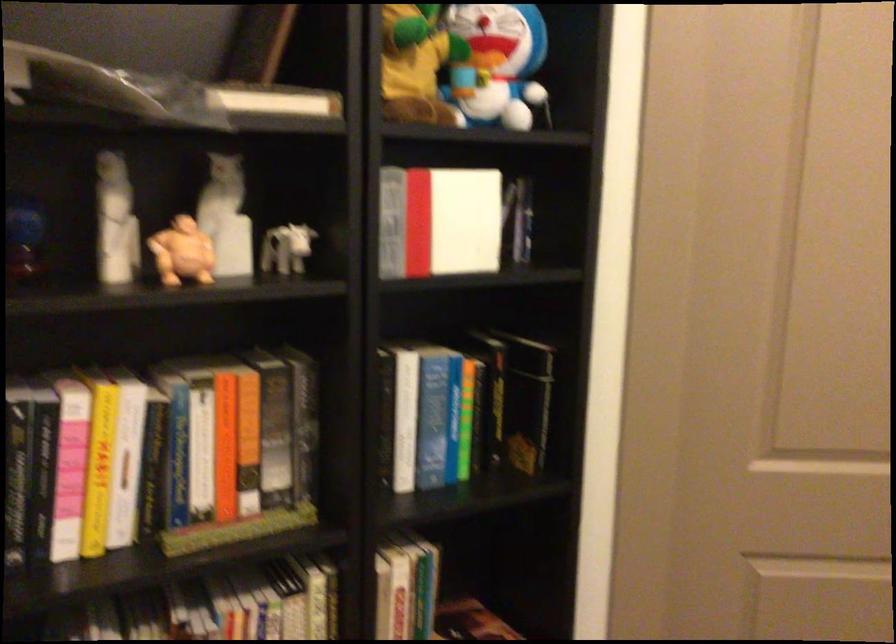
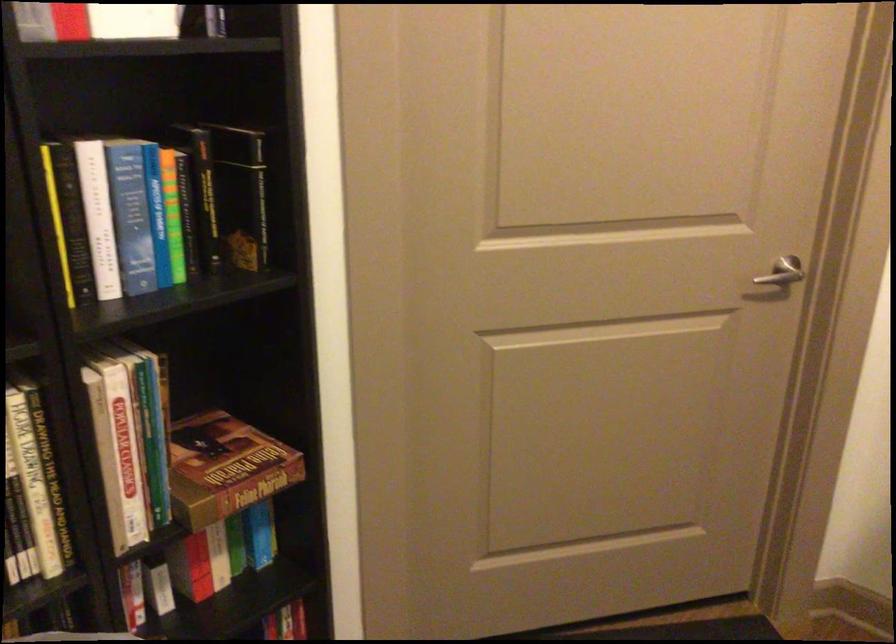
Locate, in the second image, the point that corresponds to point (468, 413) in the first image.

(171, 214)